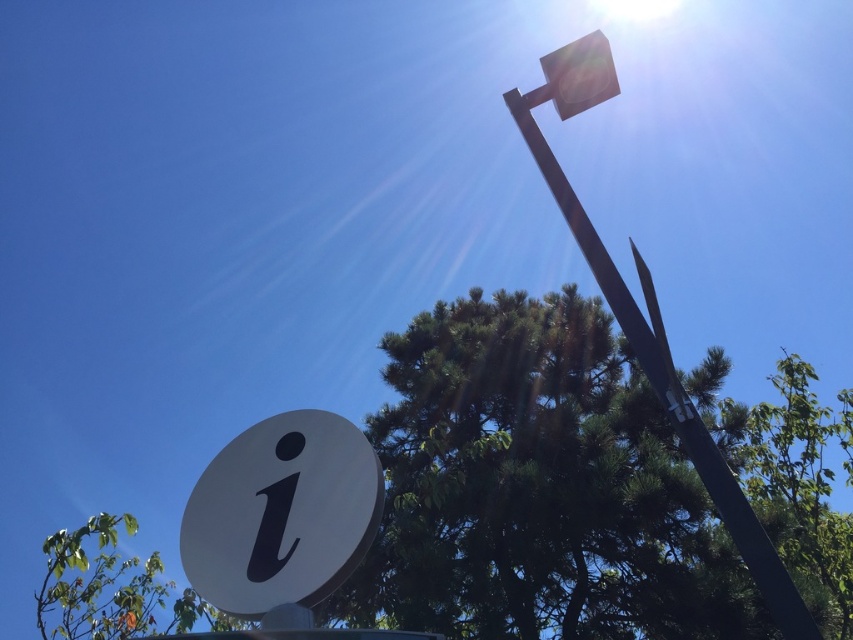
Does white matte sign at center appear on the left side of metallic gray pole at upper right?

Correct, you'll find white matte sign at center to the left of metallic gray pole at upper right.

Is point (236, 496) behind point (672, 390)?

Yes, it is behind point (672, 390).

Locate an element on the screen. This screenshot has width=853, height=640. white matte sign at center is located at coordinates (281, 513).

Can you confirm if green leafy tree at center is shorter than white matte sign at center?

No.

Is point (582, 570) farther from camera compared to point (279, 566)?

Yes, it is.

Where is `green leafy tree at center`? This screenshot has height=640, width=853. green leafy tree at center is located at coordinates (540, 486).

Can you confirm if green leafy tree at center is shorter than metallic gray pole at upper right?

No, green leafy tree at center is not shorter than metallic gray pole at upper right.

Which is in front, point (712, 524) or point (646, 372)?

Point (646, 372) is more forward.

Locate an element on the screen. green leafy tree at center is located at coordinates (540, 486).